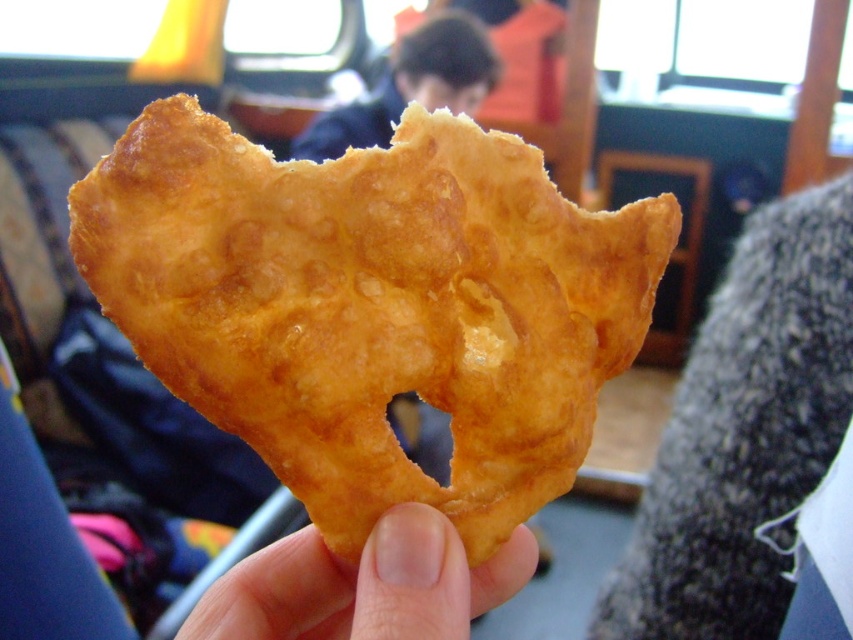
Which is behind, point (299, 346) or point (381, 632)?

The point (299, 346) is behind.

Does point (505, 339) come closer to viewer compared to point (437, 588)?

No, it is not.

Is point (218, 384) positioned behind point (219, 588)?

That is False.

Find the location of `golden crispy pastry at center`. golden crispy pastry at center is located at coordinates (373, 305).

Does flesh-toned skin at center have a larger size compared to dark blue jacket at upper center?

Incorrect, flesh-toned skin at center is not larger than dark blue jacket at upper center.

Is flesh-toned skin at center below dark blue jacket at upper center?

Indeed, flesh-toned skin at center is positioned under dark blue jacket at upper center.

Is point (328, 612) closer to viewer compared to point (486, 40)?

Yes, point (328, 612) is in front of point (486, 40).

The image size is (853, 640). What are the coordinates of `flesh-toned skin at center` in the screenshot? It's located at (364, 586).

From the picture: Which of these two, golden crispy pastry at center or dark blue jacket at upper center, stands shorter?

golden crispy pastry at center is shorter.

You are a GUI agent. You are given a task and a screenshot of the screen. Output one action in this format:
    pyautogui.click(x=<x>, y=<y>)
    Task: Click on the golden crispy pastry at center
    
    Given the screenshot: What is the action you would take?
    pyautogui.click(x=373, y=305)